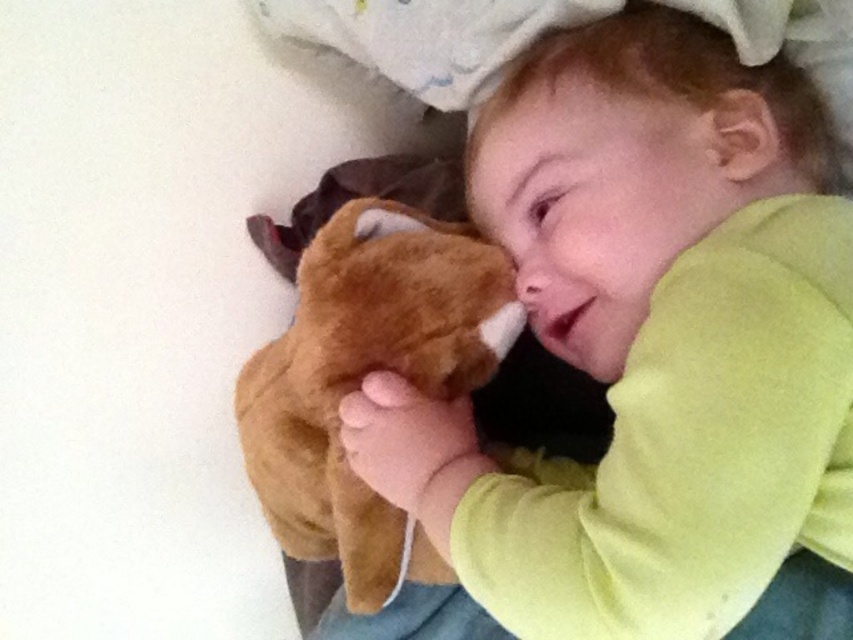
Question: Can you confirm if soft brown plush toy at center is positioned above brown plush toy at center?

Choices:
 (A) yes
 (B) no

Answer: (A)

Question: Observing the image, what is the correct spatial positioning of soft brown plush toy at center in reference to brown plush toy at center?

Choices:
 (A) above
 (B) below

Answer: (A)

Question: Is soft brown plush toy at center positioned before brown plush toy at center?

Choices:
 (A) no
 (B) yes

Answer: (B)